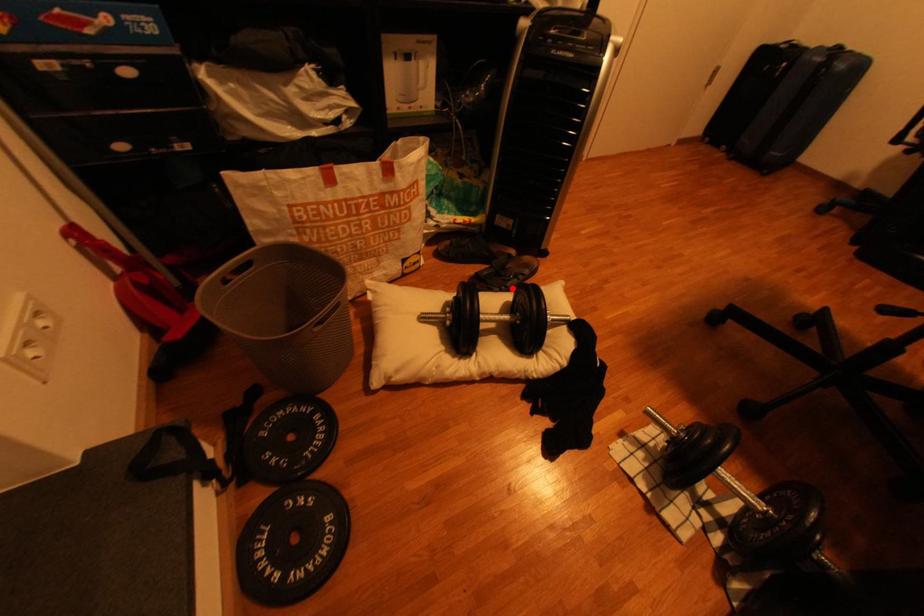
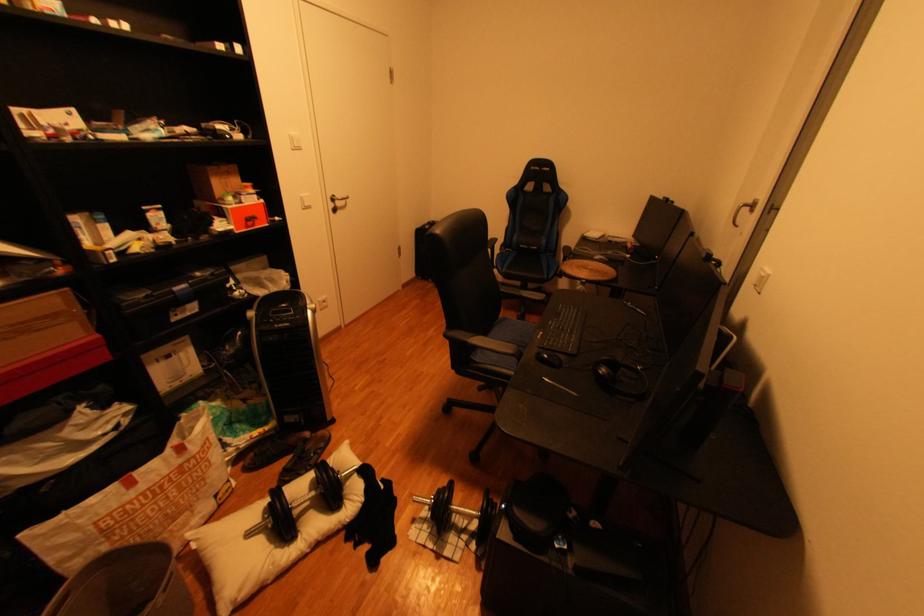
Question: I am providing you with two images of the same scene from different viewpoints. Image1 has a red point marked. In image2, the corresponding 3D location appears at what relative position? Reply with the corresponding letter.

Choices:
 (A) Closer
 (B) Farther

Answer: (A)